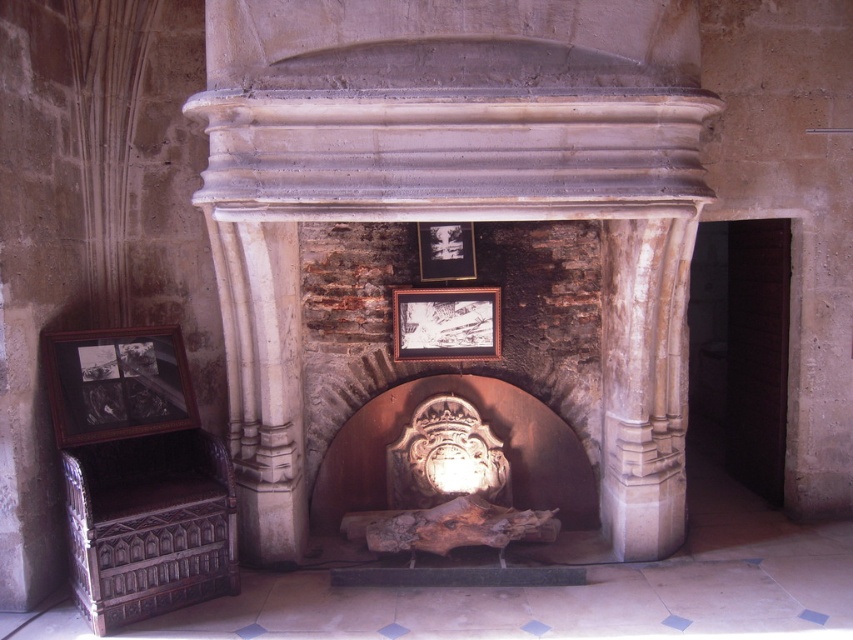
Question: Does carved stone fireplace at center have a smaller size compared to matte black picture frame at center?

Choices:
 (A) yes
 (B) no

Answer: (B)

Question: Considering the real-world distances, which object is closest to the smooth stone fireplace at center?

Choices:
 (A) wooden framed photo at left
 (B) black matte picture frame at center
 (C) white stone column at center-left

Answer: (C)

Question: Based on their relative distances, which object is farther from the black matte picture frame at center?

Choices:
 (A) white stone column at center-left
 (B) matte black picture frame at center
 (C) smooth stone fireplace at center

Answer: (A)

Question: Which of the following is the closest to the observer?

Choices:
 (A) matte black picture frame at center
 (B) carved stone fireplace at center
 (C) wooden framed photo at left
 (D) black matte picture frame at center

Answer: (C)

Question: From the image, what is the correct spatial relationship of white stone column at center-left in relation to matte black picture frame at center?

Choices:
 (A) below
 (B) above

Answer: (A)

Question: Does black matte picture frame at center appear under matte black picture frame at center?

Choices:
 (A) no
 (B) yes

Answer: (B)